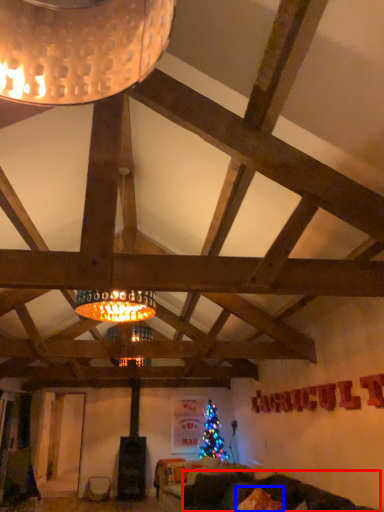
Question: Which point is further to the camera, couch (highlighted by a red box) or pillow (highlighted by a blue box)?

Choices:
 (A) couch
 (B) pillow

Answer: (B)